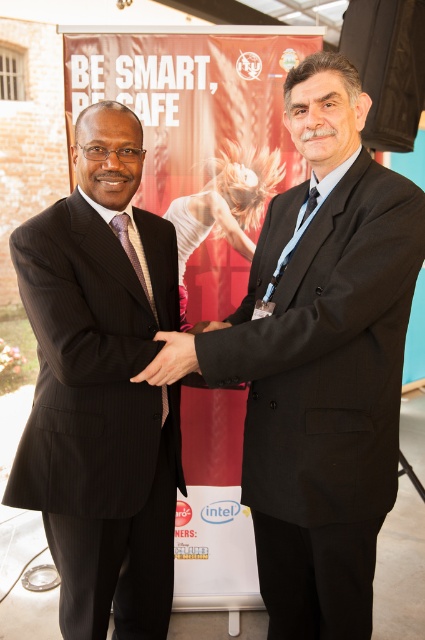
Is point (223, 481) positioned behind point (198, 326)?

That is True.

Which is more to the right, matte red poster at center or matte black hand at center?

matte red poster at center is more to the right.

Does point (156, 172) come behind point (198, 326)?

That is True.

Find the location of a particular element. The image size is (425, 640). matte red poster at center is located at coordinates tap(197, 129).

Who is shorter, black matte suit at center or matte red poster at center?

matte red poster at center

Who is more distant from viewer, (257, 278) or (195, 406)?

Positioned behind is point (195, 406).

The width and height of the screenshot is (425, 640). Find the location of `black matte suit at center`. black matte suit at center is located at coordinates (323, 362).

What do you see at coordinates (323, 362) in the screenshot? The height and width of the screenshot is (640, 425). I see `black matte suit at center` at bounding box center [323, 362].

Who is lower down, black matte suit at center or black matte hand at center?

black matte suit at center is below.

Find the location of a particular element. The image size is (425, 640). black matte suit at center is located at coordinates (323, 362).